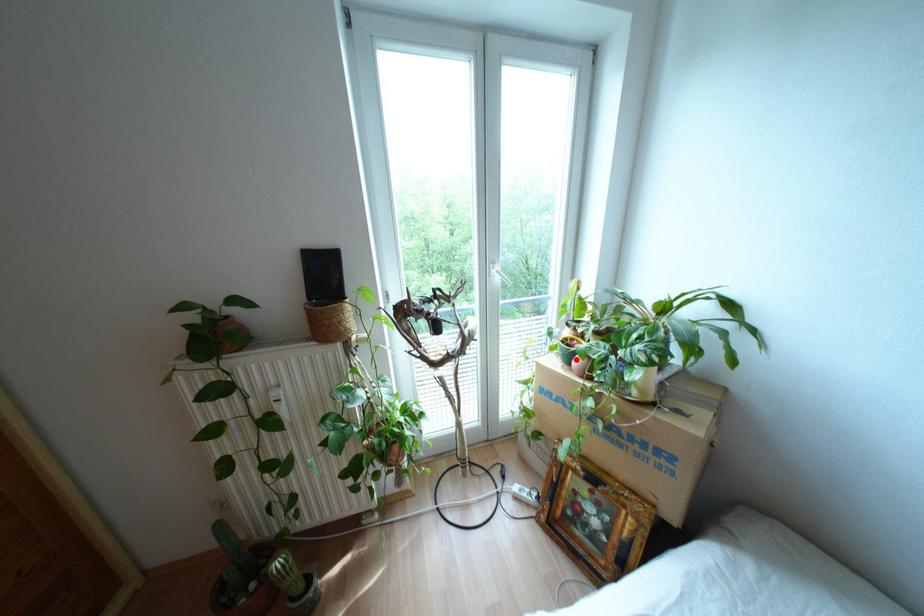
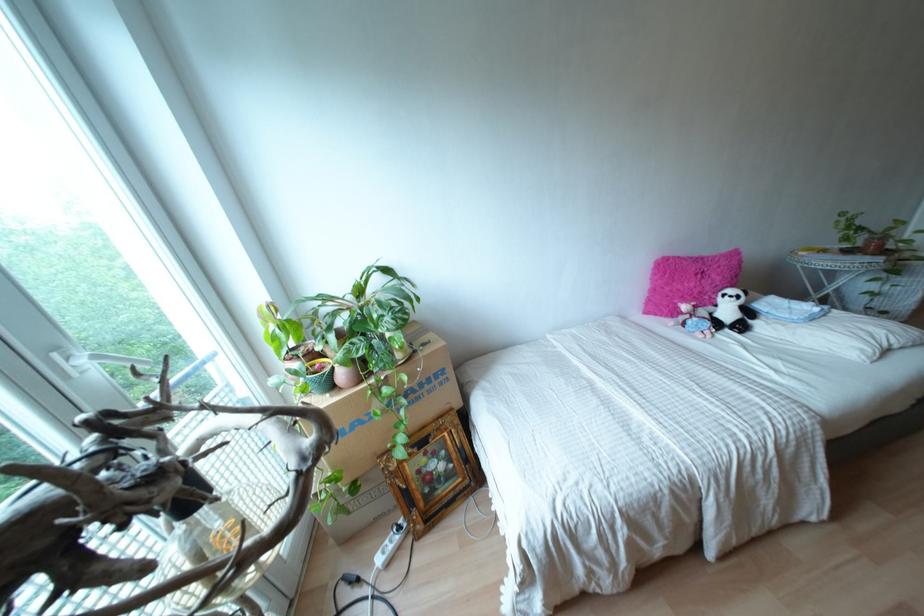
Find the pixel in the second image that matches the highlighted location in the first image.

(342, 374)